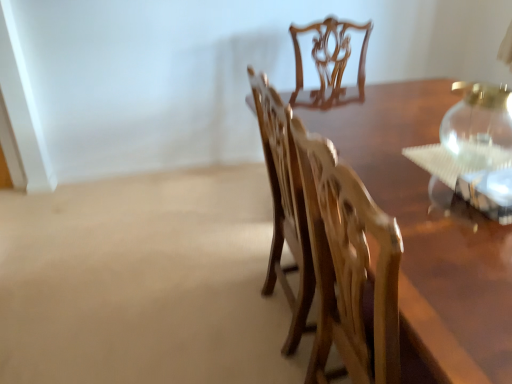
Question: Is wooden chair at center not inside transparent glass vase at upper right?

Choices:
 (A) yes
 (B) no

Answer: (A)

Question: Is wooden chair at center positioned in front of transparent glass vase at upper right?

Choices:
 (A) yes
 (B) no

Answer: (A)

Question: From the image's perspective, is wooden chair at center located above transparent glass vase at upper right?

Choices:
 (A) no
 (B) yes

Answer: (A)

Question: Considering the relative sizes of wooden chair at center and transparent glass vase at upper right in the image provided, is wooden chair at center thinner than transparent glass vase at upper right?

Choices:
 (A) no
 (B) yes

Answer: (A)

Question: Considering the relative sizes of wooden chair at center and transparent glass vase at upper right in the image provided, is wooden chair at center shorter than transparent glass vase at upper right?

Choices:
 (A) yes
 (B) no

Answer: (B)

Question: Is wooden chair at center looking in the opposite direction of transparent glass vase at upper right?

Choices:
 (A) yes
 (B) no

Answer: (B)

Question: Is transparent glass vase at upper right positioned with its back to wooden chair at center?

Choices:
 (A) no
 (B) yes

Answer: (A)

Question: Can you confirm if transparent glass vase at upper right is wider than wooden chair at center?

Choices:
 (A) yes
 (B) no

Answer: (B)

Question: Considering the relative sizes of transparent glass vase at upper right and wooden chair at center in the image provided, is transparent glass vase at upper right shorter than wooden chair at center?

Choices:
 (A) no
 (B) yes

Answer: (B)

Question: From a real-world perspective, is transparent glass vase at upper right below wooden chair at center?

Choices:
 (A) no
 (B) yes

Answer: (A)

Question: Is transparent glass vase at upper right taller than wooden chair at center?

Choices:
 (A) no
 (B) yes

Answer: (A)

Question: Considering the relative positions of transparent glass vase at upper right and wooden chair at center in the image provided, is transparent glass vase at upper right to the left of wooden chair at center from the viewer's perspective?

Choices:
 (A) no
 (B) yes

Answer: (A)

Question: Considering the positions of point (382, 369) and point (490, 92), is point (382, 369) closer or farther from the camera than point (490, 92)?

Choices:
 (A) closer
 (B) farther

Answer: (A)